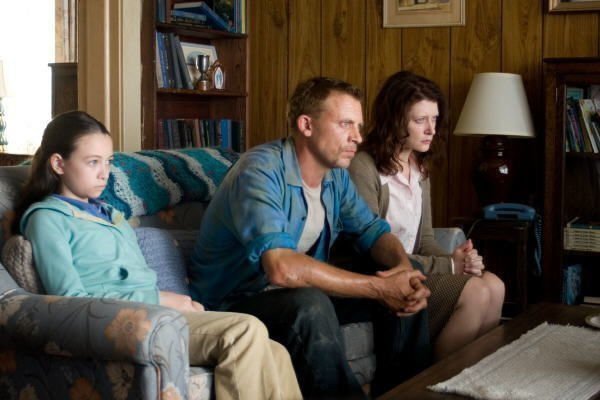
Find the location of `paneled wall`. paneled wall is located at coordinates (319, 48).